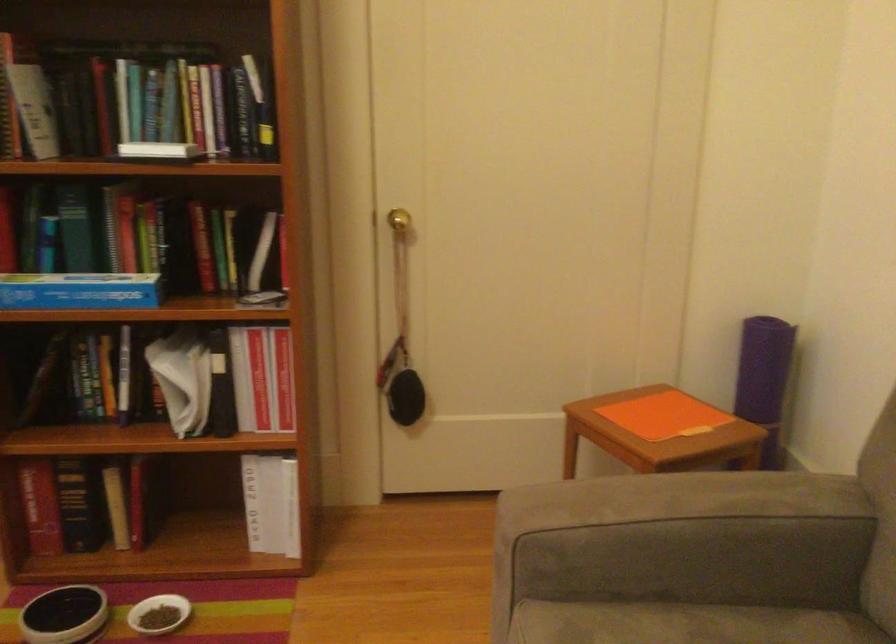
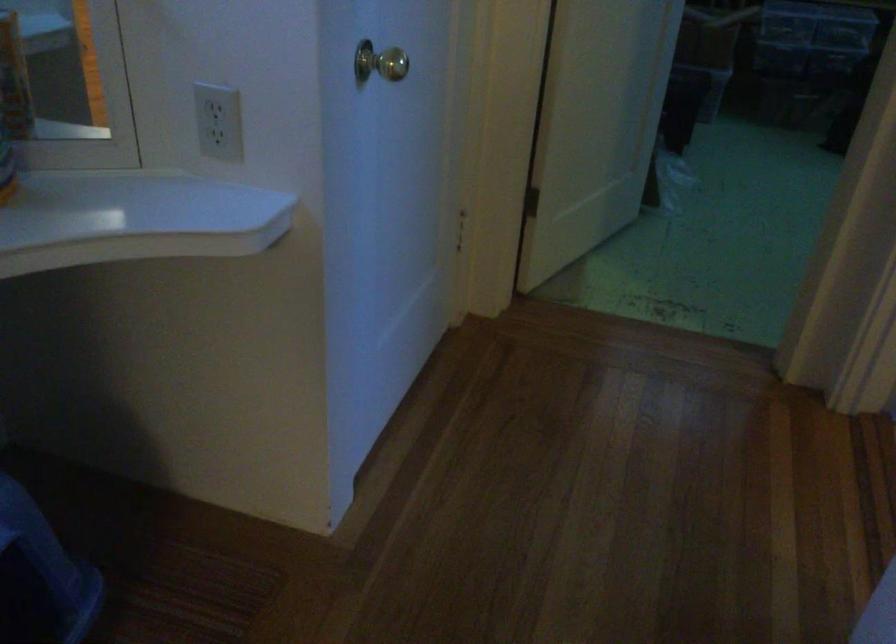
In a continuous first-person perspective shot, in which direction is the camera moving?

The cameraman walked toward left, forward.